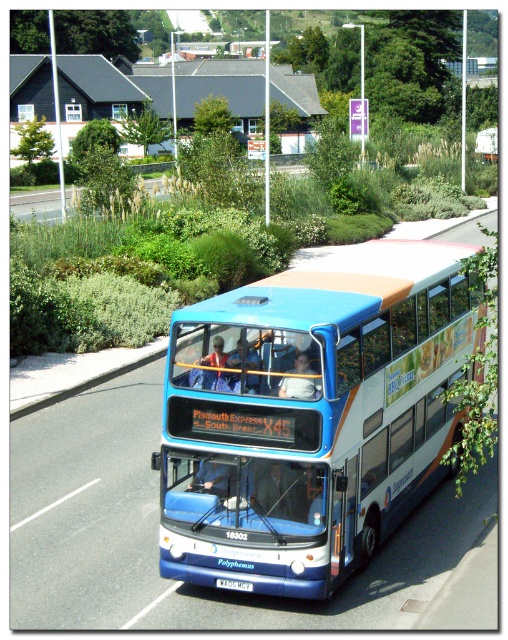
Which of these two, blue metallic bus at center or white plastic license plate at center, stands shorter?

With less height is white plastic license plate at center.

Does blue metallic bus at center have a greater width compared to white plastic license plate at center?

Incorrect, blue metallic bus at center's width does not surpass white plastic license plate at center's.

Is point (244, 321) positioned after point (238, 588)?

No, it is in front of (238, 588).

Find the location of a particular element. Image resolution: width=508 pixels, height=640 pixels. blue metallic bus at center is located at coordinates (310, 413).